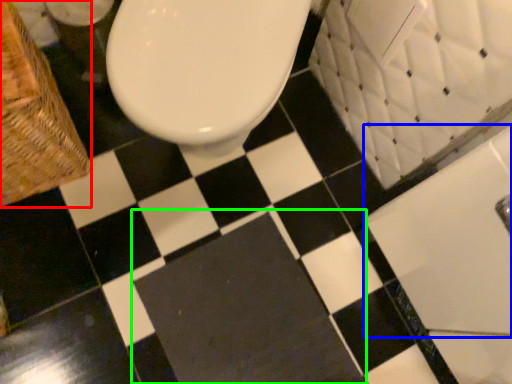
Question: Which is farther away from basket (highlighted by a red box)? bath (highlighted by a blue box) or bath mat (highlighted by a green box)?

Choices:
 (A) bath
 (B) bath mat

Answer: (A)